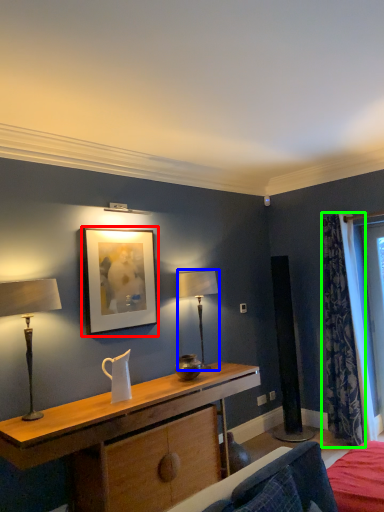
Question: Considering the real-world distances, which object is farthest from picture frame (highlighted by a red box)? table lamp (highlighted by a blue box) or curtain (highlighted by a green box)?

Choices:
 (A) table lamp
 (B) curtain

Answer: (B)